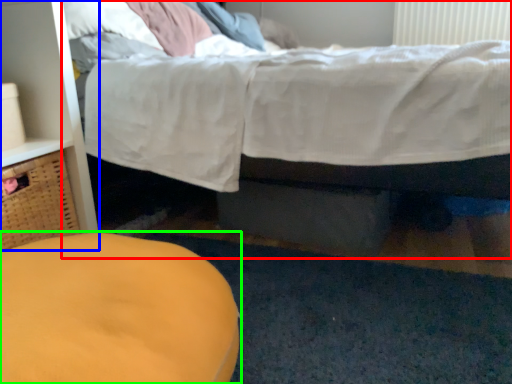
Question: Which object is the closest to the bed (highlighted by a red box)? Choose among these: dresser (highlighted by a blue box) or furniture (highlighted by a green box).

Choices:
 (A) dresser
 (B) furniture

Answer: (A)